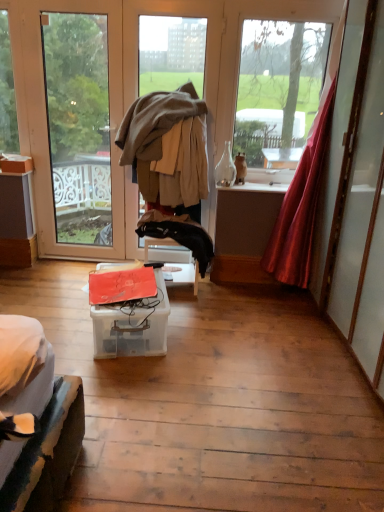
Question: From their relative heights in the image, would you say clear glass bottle at center is taller or shorter than transparent glass door at left, which is counted as the first window, starting from the left?

Choices:
 (A) tall
 (B) short

Answer: (B)

Question: From a real-world perspective, relative to transparent glass door at left, which is counted as the first window, starting from the left, is clear glass bottle at center vertically above or below?

Choices:
 (A) below
 (B) above

Answer: (A)

Question: Estimate the real-world distances between objects in this image. Which object is farther from the transparent plastic box at center, which is the first box in right-to-left order?

Choices:
 (A) matte cardboard box at left, acting as the second box starting from the bottom
 (B) matte brown vase at upper center
 (C) satin red curtain at right
 (D) black fabric jacket at center
 (E) beige woolen jacket at center

Answer: (A)

Question: Based on their relative distances, which object is nearer to the transparent glass window at upper right, which is the 2th window in left-to-right order?

Choices:
 (A) matte brown vase at upper center
 (B) satin red curtain at right
 (C) transparent plastic box at center, which ranks as the 2th box in left-to-right order
 (D) matte cardboard box at left, which ranks as the first box in back-to-front order
 (E) clear glass bottle at center

Answer: (A)